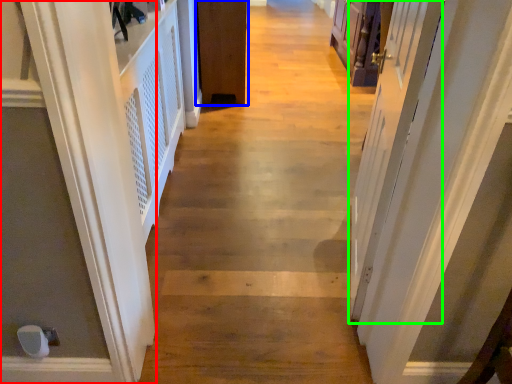
Question: Estimate the real-world distances between objects in this image. Which object is closer to door (highlighted by a red box), door (highlighted by a blue box) or screen door (highlighted by a green box)?

Choices:
 (A) door
 (B) screen door

Answer: (B)